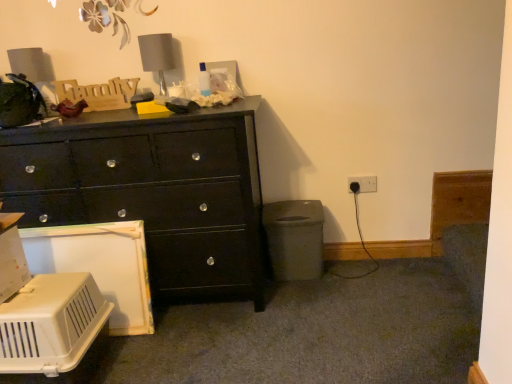
Question: Is black glossy chest of drawers at left further to the viewer compared to black plastic electric outlet at lower right?

Choices:
 (A) no
 (B) yes

Answer: (A)

Question: Considering the relative sizes of black glossy chest of drawers at left and black plastic electric outlet at lower right in the image provided, is black glossy chest of drawers at left wider than black plastic electric outlet at lower right?

Choices:
 (A) yes
 (B) no

Answer: (A)

Question: Is there a large distance between black glossy chest of drawers at left and black plastic electric outlet at lower right?

Choices:
 (A) yes
 (B) no

Answer: (A)

Question: Could black plastic electric outlet at lower right be considered to be inside black glossy chest of drawers at left?

Choices:
 (A) yes
 (B) no

Answer: (B)

Question: From a real-world perspective, does black glossy chest of drawers at left stand above black plastic electric outlet at lower right?

Choices:
 (A) yes
 (B) no

Answer: (A)

Question: Considering the positions of gray fabric lampshade at upper center and black plastic electric outlet at lower right in the image, is gray fabric lampshade at upper center taller or shorter than black plastic electric outlet at lower right?

Choices:
 (A) short
 (B) tall

Answer: (B)

Question: From a real-world perspective, is gray fabric lampshade at upper center above or below black plastic electric outlet at lower right?

Choices:
 (A) above
 (B) below

Answer: (A)

Question: In terms of width, does gray fabric lampshade at upper center look wider or thinner when compared to black plastic electric outlet at lower right?

Choices:
 (A) thin
 (B) wide

Answer: (B)

Question: From the image's perspective, is gray fabric lampshade at upper center located above or below black plastic electric outlet at lower right?

Choices:
 (A) above
 (B) below

Answer: (A)

Question: From a real-world perspective, is black plastic electric outlet at lower right positioned above or below white plastic pet carrier at lower left?

Choices:
 (A) below
 (B) above

Answer: (B)

Question: Based on their sizes in the image, would you say black plastic electric outlet at lower right is bigger or smaller than white plastic pet carrier at lower left?

Choices:
 (A) small
 (B) big

Answer: (A)

Question: Would you say black plastic electric outlet at lower right is inside or outside white plastic pet carrier at lower left?

Choices:
 (A) outside
 (B) inside

Answer: (A)

Question: From the image's perspective, is black plastic electric outlet at lower right positioned above or below white plastic pet carrier at lower left?

Choices:
 (A) above
 (B) below

Answer: (A)

Question: Would you say gray fabric lampshade at upper center is inside or outside white plastic pet carrier at lower left?

Choices:
 (A) outside
 (B) inside

Answer: (A)

Question: From the image's perspective, is gray fabric lampshade at upper center located above or below white plastic pet carrier at lower left?

Choices:
 (A) below
 (B) above

Answer: (B)